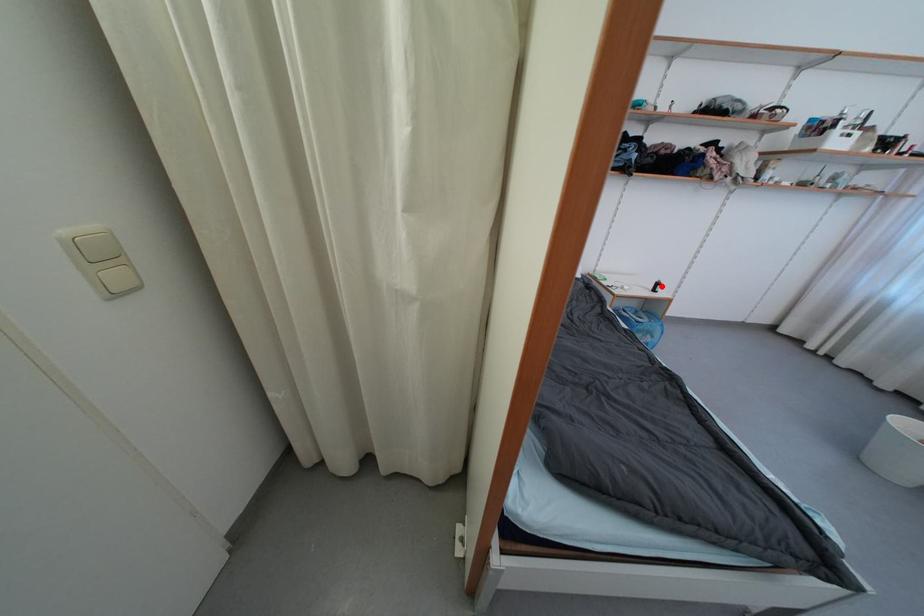
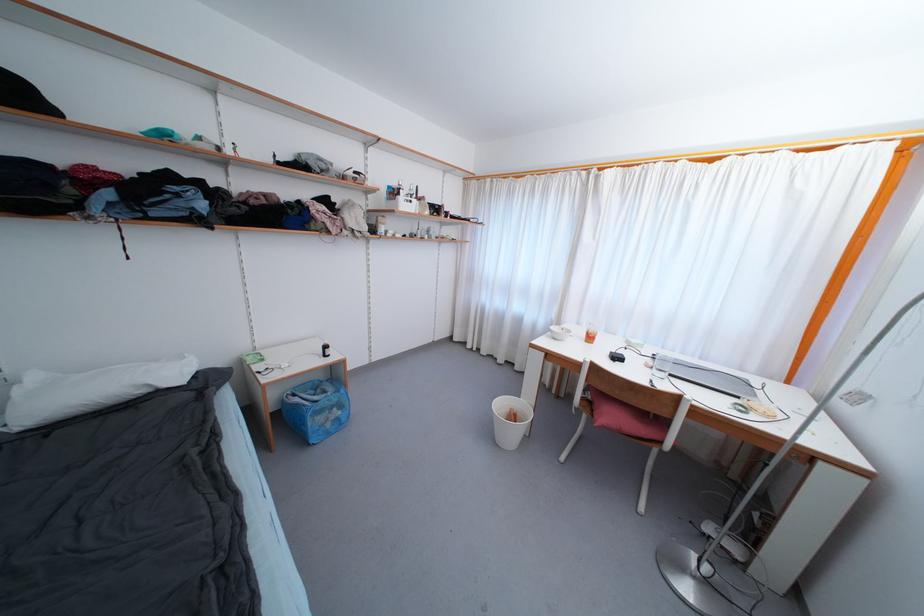
Where in the second image is the point corresponding to the highlighted location from the first image?

(330, 350)